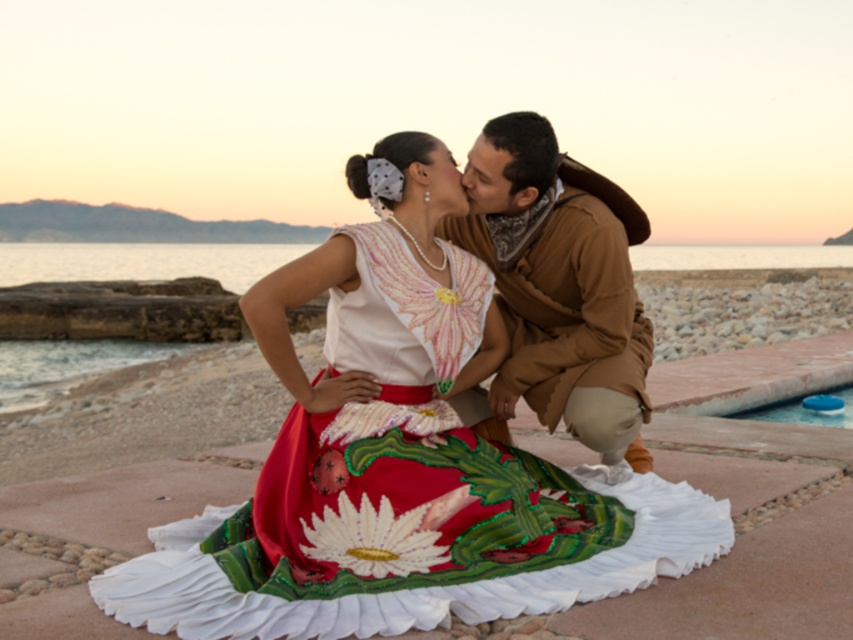
Question: Estimate the real-world distances between objects in this image. Which object is farther from the brown suede jacket at center?

Choices:
 (A) matte brown forehead at upper center
 (B) embroidered silk dress at center

Answer: (B)

Question: Is the position of brown suede jacket at center more distant than that of matte brown forehead at upper center?

Choices:
 (A) yes
 (B) no

Answer: (A)

Question: Is brown suede jacket at center wider than matte brown forehead at upper center?

Choices:
 (A) no
 (B) yes

Answer: (B)

Question: Which object is closer to the camera taking this photo?

Choices:
 (A) embroidered silk dress at center
 (B) brown suede jacket at center

Answer: (A)

Question: Where is brown suede jacket at center located in relation to blue plastic lid at lower right in the image?

Choices:
 (A) right
 (B) left

Answer: (B)

Question: Which of the following is the closest to the observer?

Choices:
 (A) matte brown forehead at upper center
 (B) brown suede jacket at center
 (C) blue plastic lid at lower right
 (D) embroidered silk dress at center

Answer: (D)